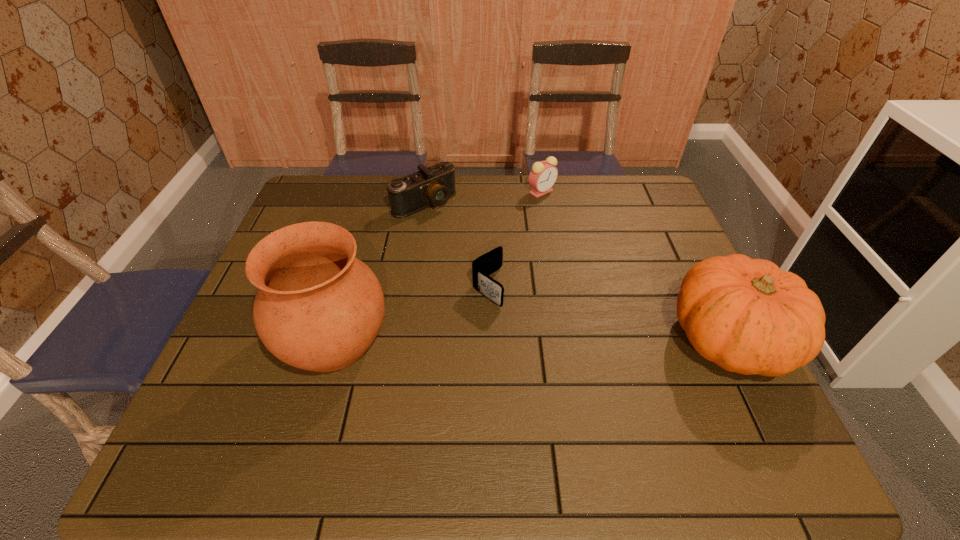
What are the coordinates of `pottery present at the near edge` in the screenshot? It's located at (318, 308).

Where is `pumpkin positioned at the near edge`? The height and width of the screenshot is (540, 960). pumpkin positioned at the near edge is located at coordinates (746, 315).

Where is `object that is at the left edge`? object that is at the left edge is located at coordinates (318, 308).

Find the location of a particular element. This screenshot has width=960, height=540. object at the right edge is located at coordinates [746, 315].

Where is `object that is positioned at the near left corner`? This screenshot has height=540, width=960. object that is positioned at the near left corner is located at coordinates (318, 308).

Where is `object situated at the near right corner`? object situated at the near right corner is located at coordinates (746, 315).

What are the coordinates of `free location at the far edge of the desktop` in the screenshot? It's located at (481, 216).

Where is `vacant region at the near edge`? vacant region at the near edge is located at coordinates (527, 399).

Locate an element on the screen. The image size is (960, 540). free space at the right edge is located at coordinates (644, 220).

In the image, there is a desktop. Where is `vacant space at the far left corner`? The width and height of the screenshot is (960, 540). vacant space at the far left corner is located at coordinates (300, 203).